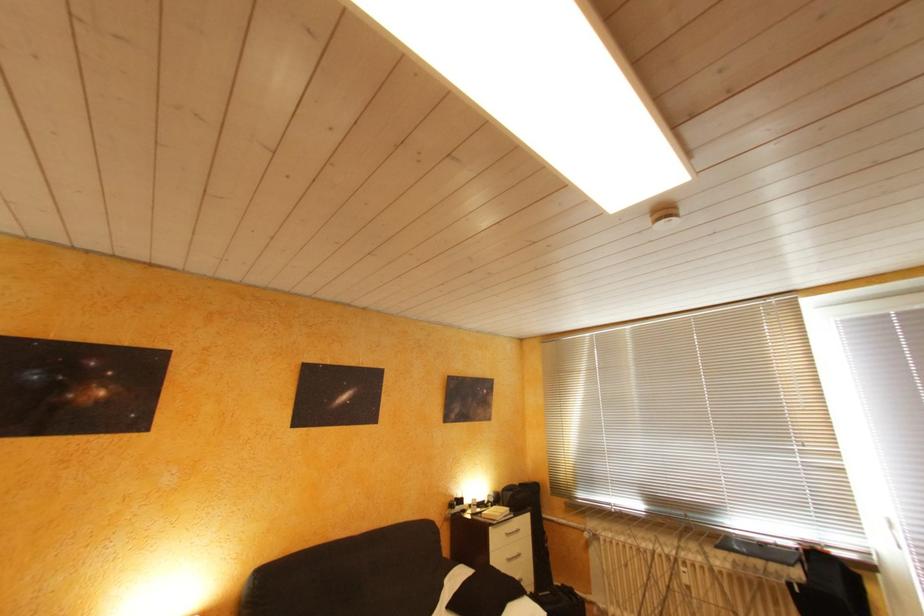
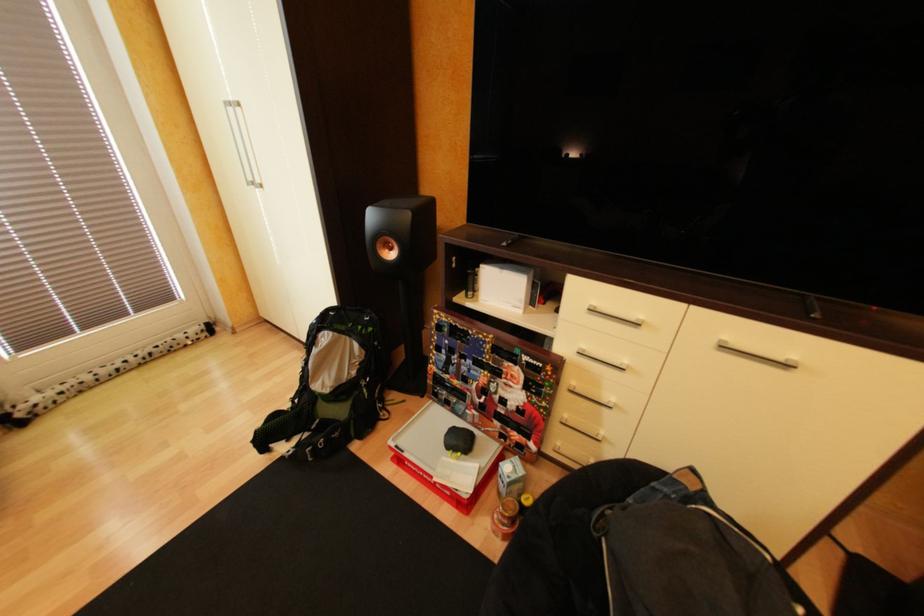
First-person continuous shooting, in which direction is the camera rotating?

The camera rotated toward right-down.